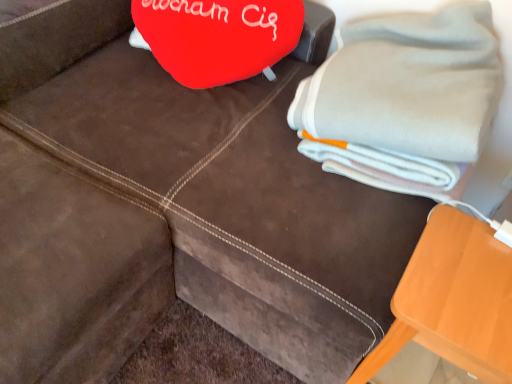
Question: Is orange wood table at lower right shorter than gray cotton bath towel at upper right?

Choices:
 (A) yes
 (B) no

Answer: (B)

Question: Is orange wood table at lower right bigger than gray cotton bath towel at upper right?

Choices:
 (A) yes
 (B) no

Answer: (B)

Question: Can you confirm if orange wood table at lower right is wider than gray cotton bath towel at upper right?

Choices:
 (A) yes
 (B) no

Answer: (B)

Question: Is orange wood table at lower right in front of gray cotton bath towel at upper right?

Choices:
 (A) no
 (B) yes

Answer: (B)

Question: Could you tell me if orange wood table at lower right is turned towards gray cotton bath towel at upper right?

Choices:
 (A) no
 (B) yes

Answer: (A)

Question: Is there a large distance between orange wood table at lower right and gray cotton bath towel at upper right?

Choices:
 (A) yes
 (B) no

Answer: (B)

Question: Can you confirm if gray cotton bath towel at upper right is taller than orange wood table at lower right?

Choices:
 (A) yes
 (B) no

Answer: (B)

Question: Is gray cotton bath towel at upper right closer to the viewer compared to orange wood table at lower right?

Choices:
 (A) no
 (B) yes

Answer: (A)

Question: Is there a large distance between gray cotton bath towel at upper right and orange wood table at lower right?

Choices:
 (A) no
 (B) yes

Answer: (A)

Question: Considering the relative sizes of gray cotton bath towel at upper right and orange wood table at lower right in the image provided, is gray cotton bath towel at upper right wider than orange wood table at lower right?

Choices:
 (A) no
 (B) yes

Answer: (B)

Question: Is gray cotton bath towel at upper right directly adjacent to orange wood table at lower right?

Choices:
 (A) no
 (B) yes

Answer: (A)

Question: Does gray cotton bath towel at upper right appear on the right side of orange wood table at lower right?

Choices:
 (A) yes
 (B) no

Answer: (B)

Question: Relative to orange wood table at lower right, is gray cotton bath towel at upper right in front or behind?

Choices:
 (A) front
 (B) behind

Answer: (B)